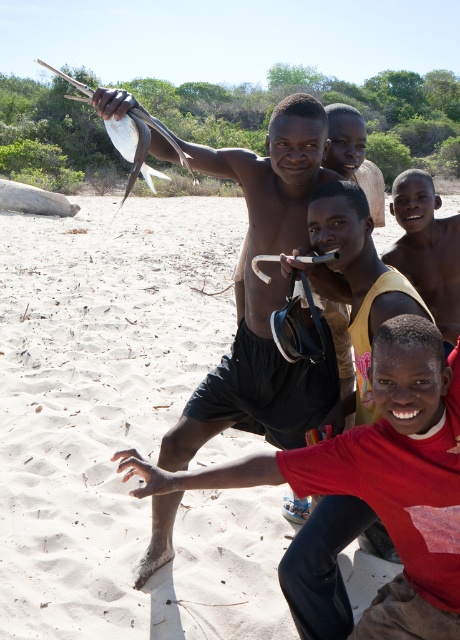
You are a photographer standing at the beach scene. You notice the red cotton shirt at lower right and the matte yellow shirt at center. Which shirt is positioned closer to you?

The red cotton shirt at lower right is closer to the viewer than the matte yellow shirt at center.

You are standing on the beach and see two points marked on the sand. The first point is at coordinates point (243, 154) and the second is at point (403, 241). Which point is closer to you?

The point at coordinates point (243, 154) is closer to you than the point at point (403, 241).